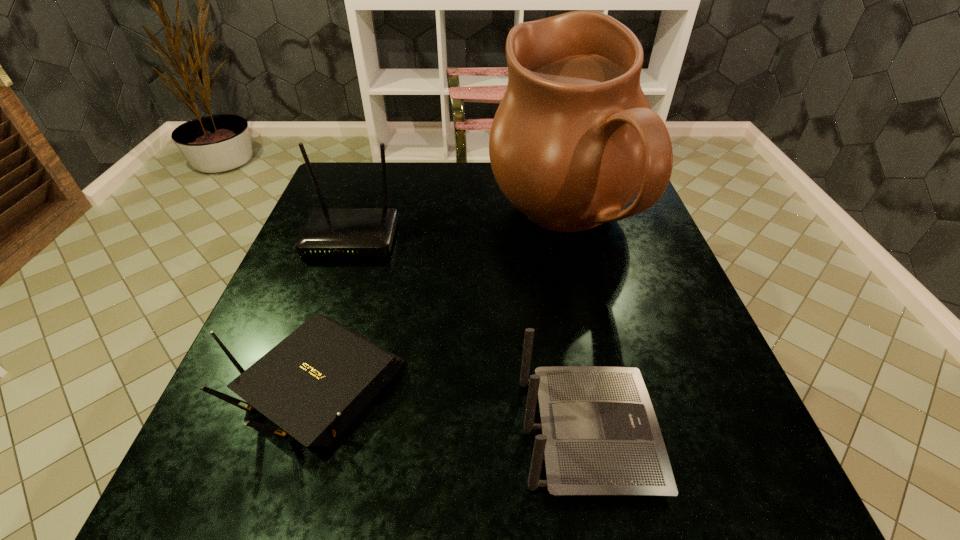
Locate an element on the screen. Image resolution: width=960 pixels, height=540 pixels. cream pitcher is located at coordinates (574, 140).

I want to click on the tallest router, so click(326, 232).

Locate an element on the screen. The width and height of the screenshot is (960, 540). the farthest router is located at coordinates (326, 232).

Identify the location of the second tallest router. The image size is (960, 540). (600, 436).

Find the location of a particular element. the second shortest object is located at coordinates (600, 436).

Where is `the shortest object`? The width and height of the screenshot is (960, 540). the shortest object is located at coordinates coord(314,383).

You are a GUI agent. You are given a task and a screenshot of the screen. Output one action in this format:
    pyautogui.click(x=<x>, y=<y>)
    Task: Click on the free space located 0.320m at the spout of the cream pitcher
    The height and width of the screenshot is (540, 960).
    Given the screenshot: What is the action you would take?
    pyautogui.click(x=360, y=223)

Identify the location of free space located 0.330m at the spout of the cream pitcher. (356, 223).

In order to click on vacant area located at the spout of the cream pitcher in this screenshot , I will do `click(388, 223)`.

The image size is (960, 540). Identify the location of vacant space located 0.380m on the front-facing side of the tallest router. (291, 413).